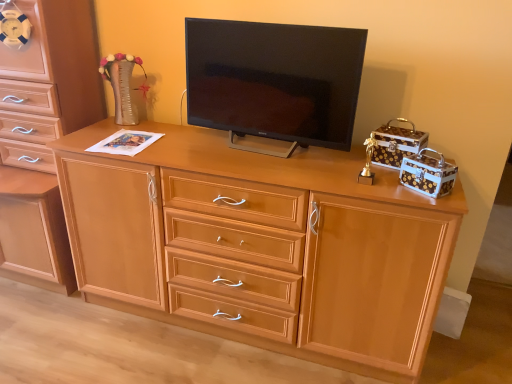
Question: Considering the positions of matte black tv at center and light brown wood chest of drawers at left in the image, is matte black tv at center taller or shorter than light brown wood chest of drawers at left?

Choices:
 (A) short
 (B) tall

Answer: (A)

Question: Is matte black tv at center in front of or behind light brown wood chest of drawers at left in the image?

Choices:
 (A) behind
 (B) front

Answer: (B)

Question: Estimate the real-world distances between objects in this image. Which object is closer to the matte black tv at center?

Choices:
 (A) light brown wood chest of drawers at left
 (B) light wood cabinet at center

Answer: (B)

Question: Which object is positioned farthest from the light brown wood chest of drawers at left?

Choices:
 (A) matte black tv at center
 (B) light wood cabinet at center

Answer: (A)